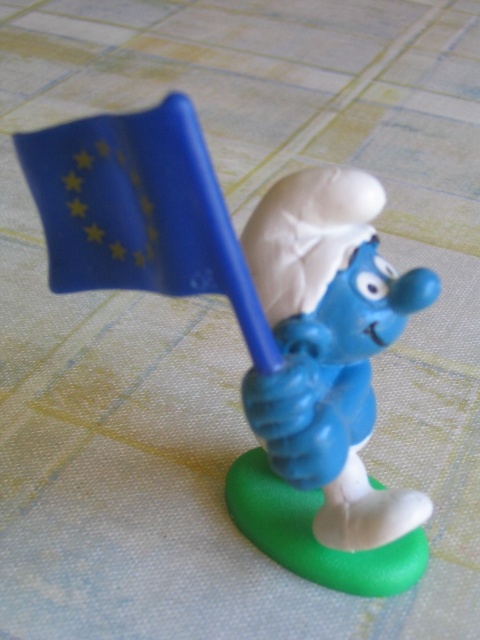
You are a collector who wants to display both the blue plastic smurf at center and the blue matte smurf at center on a shelf. Since the shelf has limited space, which of the two Smurfs should you place first to ensure both fit?

The blue plastic smurf at center is larger than the blue matte smurf at center. To ensure both fit on the shelf, place the larger blue plastic smurf at center first, then the smaller blue matte smurf at center next to it.

What are the coordinates of the blue plastic smurf at center?

The coordinates of the blue plastic smurf at center are at point (254, 321).